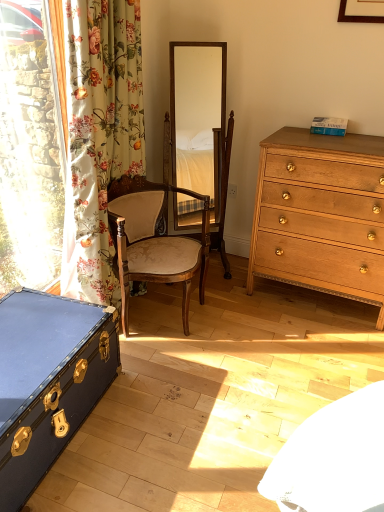
The height and width of the screenshot is (512, 384). Find the location of `vacant area that is in front of wooden mirror at center`. vacant area that is in front of wooden mirror at center is located at coordinates (228, 295).